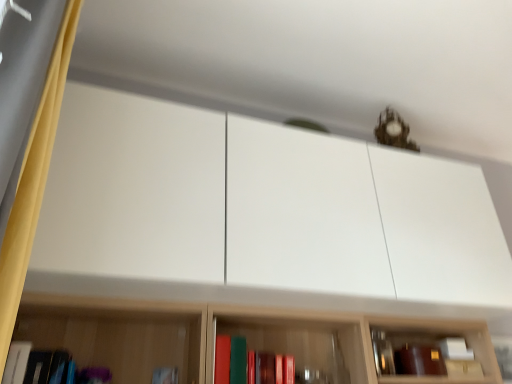
Question: From the image's perspective, would you say matte red book at center, which is the third book from left to right, is shown under matte white book at lower left, marked as the second book in a right-to-left arrangement?

Choices:
 (A) yes
 (B) no

Answer: (B)

Question: Does matte red book at center, the first book when ordered from right to left, have a lesser width compared to matte white book at lower left, marked as the second book in a right-to-left arrangement?

Choices:
 (A) no
 (B) yes

Answer: (A)

Question: Can you confirm if matte red book at center, which is the third book from left to right, is taller than matte white book at lower left, marked as the second book in a left-to-right arrangement?

Choices:
 (A) yes
 (B) no

Answer: (B)

Question: Does matte red book at center, the first book when ordered from right to left, have a larger size compared to matte white book at lower left, marked as the second book in a right-to-left arrangement?

Choices:
 (A) yes
 (B) no

Answer: (A)

Question: Considering the relative positions of matte red book at center, which is the third book from left to right, and matte white book at lower left, marked as the second book in a right-to-left arrangement, in the image provided, is matte red book at center, which is the third book from left to right, to the right of matte white book at lower left, marked as the second book in a right-to-left arrangement, from the viewer's perspective?

Choices:
 (A) yes
 (B) no

Answer: (A)

Question: Does matte red book at center, which is the third book from left to right, come behind matte white book at lower left, marked as the second book in a right-to-left arrangement?

Choices:
 (A) yes
 (B) no

Answer: (B)

Question: Can you confirm if yellow fabric curtain at left is wider than matte red book at center, which is the third book from left to right?

Choices:
 (A) no
 (B) yes

Answer: (A)

Question: Is yellow fabric curtain at left touching matte red book at center, the first book when ordered from right to left?

Choices:
 (A) yes
 (B) no

Answer: (B)

Question: Does yellow fabric curtain at left have a smaller size compared to matte red book at center, which is the third book from left to right?

Choices:
 (A) yes
 (B) no

Answer: (B)

Question: Can you confirm if yellow fabric curtain at left is taller than matte red book at center, which is the third book from left to right?

Choices:
 (A) yes
 (B) no

Answer: (A)

Question: Is the depth of yellow fabric curtain at left less than that of matte red book at center, the first book when ordered from right to left?

Choices:
 (A) no
 (B) yes

Answer: (B)

Question: Is yellow fabric curtain at left positioned behind matte red book at center, which is the third book from left to right?

Choices:
 (A) yes
 (B) no

Answer: (B)

Question: From a real-world perspective, is matte red book at center, which is the third book from left to right, positioned under yellow fabric curtain at left based on gravity?

Choices:
 (A) no
 (B) yes

Answer: (B)